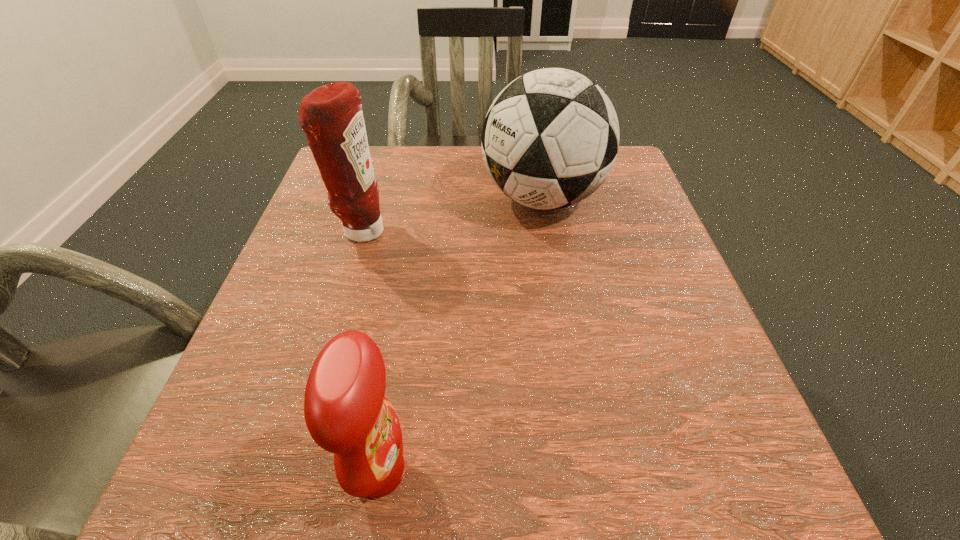
Locate an element on the screen. The image size is (960, 540). the left condiment is located at coordinates (331, 116).

This screenshot has width=960, height=540. I want to click on the taller condiment, so click(x=331, y=116).

You are a GUI agent. You are given a task and a screenshot of the screen. Output one action in this format:
    pyautogui.click(x=<x>, y=<y>)
    Task: Click on the soccer ball
    This screenshot has height=540, width=960.
    Given the screenshot: What is the action you would take?
    pyautogui.click(x=550, y=138)

At what (x,y) coordinates should I click in order to perform the action: click on the nearest object. Please return your answer as a coordinate pair (x, y). The image size is (960, 540). Looking at the image, I should click on (346, 413).

At what (x,y) coordinates should I click in order to perform the action: click on the nearer condiment. Please return your answer as a coordinate pair (x, y). Looking at the image, I should click on (346, 413).

Locate an element on the screen. vacant position located on the front of the farther condiment is located at coordinates (348, 274).

The width and height of the screenshot is (960, 540). I want to click on free location located 0.340m on the surface of the rightmost object where the brand logo is visible, so click(x=324, y=198).

The width and height of the screenshot is (960, 540). Find the location of `vacant space situated 0.240m on the surface of the rightmost object where the brand logo is visible`. vacant space situated 0.240m on the surface of the rightmost object where the brand logo is visible is located at coordinates (371, 198).

You are a GUI agent. You are given a task and a screenshot of the screen. Output one action in this format:
    pyautogui.click(x=<x>, y=<y>)
    Task: Click on the vacant position located 0.090m on the surface of the rightmost object where the brand logo is visible
    This screenshot has height=540, width=960.
    Given the screenshot: What is the action you would take?
    440,198

Locate an element on the screen. Image resolution: width=960 pixels, height=540 pixels. free spot located 0.150m on the label side of the right condiment is located at coordinates (530, 471).